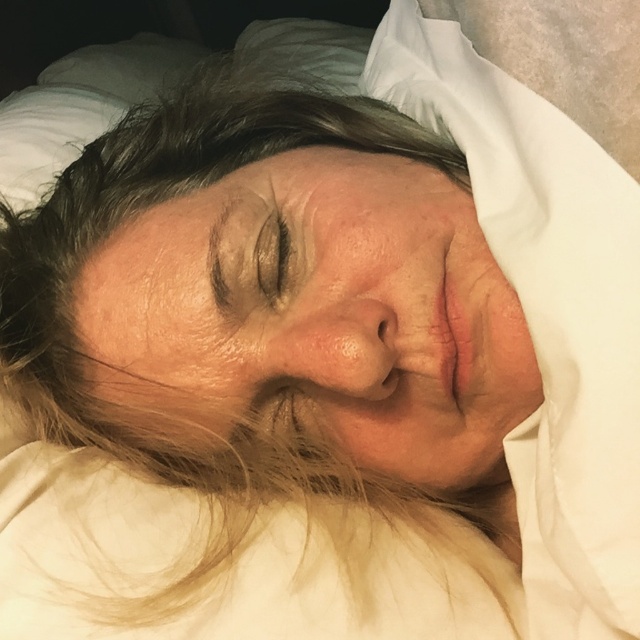
Question: In this image, where is dry skin at center located relative to brown matte eye at center?

Choices:
 (A) left
 (B) right

Answer: (B)

Question: Is dry skin at center positioned in front of brown matte eye at center?

Choices:
 (A) no
 (B) yes

Answer: (B)

Question: Which point is farther to the camera?

Choices:
 (A) (275, 288)
 (B) (298, 161)

Answer: (B)

Question: Is dry skin at center smaller than brown matte eye at center?

Choices:
 (A) no
 (B) yes

Answer: (A)

Question: Among these points, which one is farthest from the camera?

Choices:
 (A) (260, 241)
 (B) (496, 404)

Answer: (B)